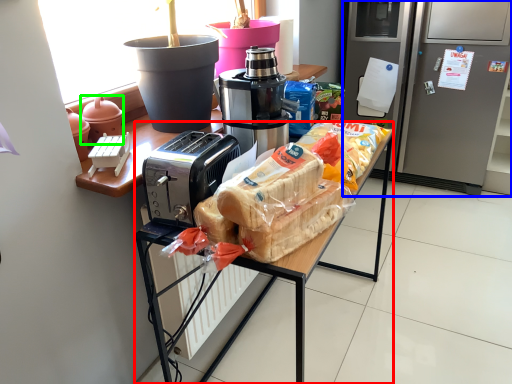
Question: Which object is positioned farthest from desk (highlighted by a red box)? Select from home appliance (highlighted by a blue box) and appliance (highlighted by a green box).

Choices:
 (A) home appliance
 (B) appliance

Answer: (A)